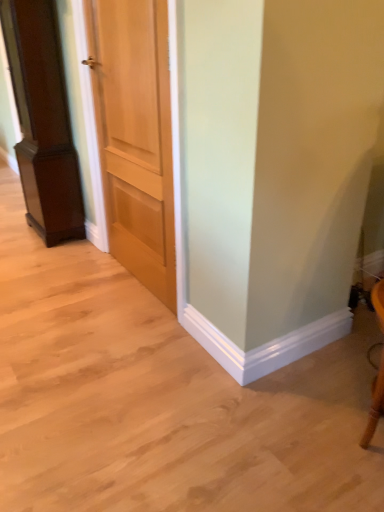
The width and height of the screenshot is (384, 512). Find the location of `free space in front of light brown wood door at center`. free space in front of light brown wood door at center is located at coordinates (107, 332).